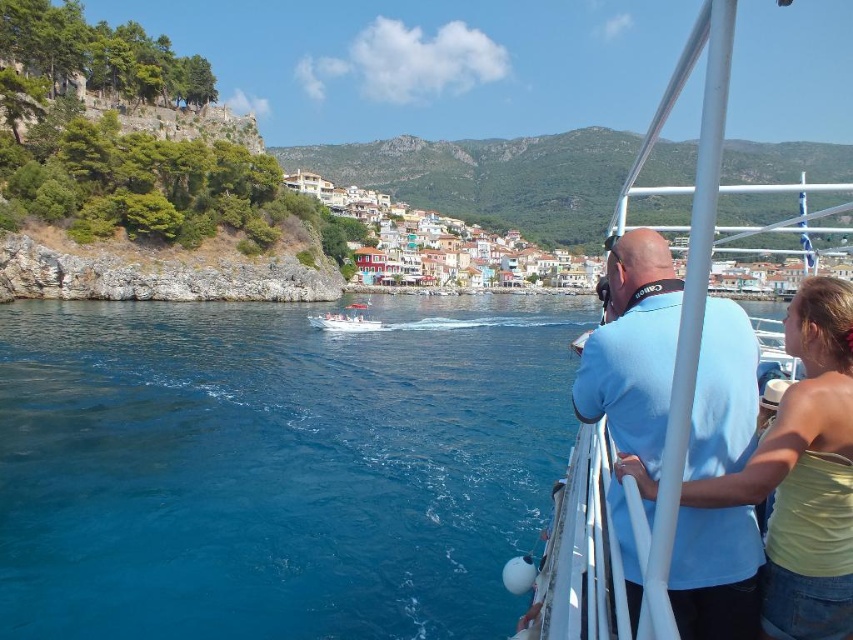
You are standing on the boat and want to take a photo of the white plastic boat at center without the light blue cotton shirt at upper right blocking the view. Is this possible?

The light blue cotton shirt at upper right is closer to the viewer than the white plastic boat at center, so the shirt will block the view of the boat. Move to a different position where the shirt is not in front of the boat.

You are standing on the boat and want to place a rectangular box that is 1 meter wide between the white plastic boat at right and the yellow matte tank top at right. Can you fit the box between them?

The white plastic boat at right might be wider than the yellow matte tank top at right, so the box may not fit between them if the distance is less than 1 meter.

You are standing on the boat and want to take a photo of the white plastic boat at right and the yellow matte tank top at right. Which one should you point your camera towards first if you want to capture both in a single shot?

You should point your camera towards the yellow matte tank top at right first because the white plastic boat at right is to the right of it, so capturing the left side first will include both in the frame.